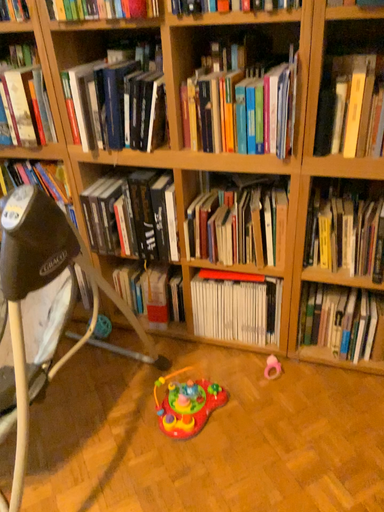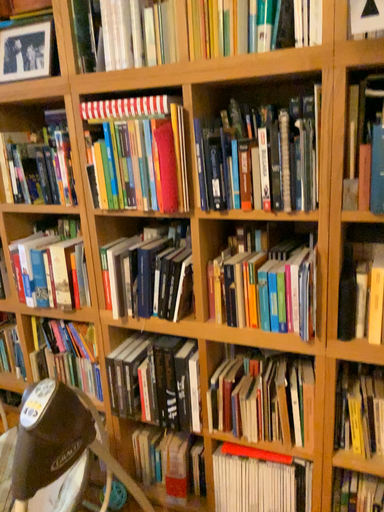
Question: How did the camera likely rotate when shooting the video?

Choices:
 (A) rotated upward
 (B) rotated downward

Answer: (A)